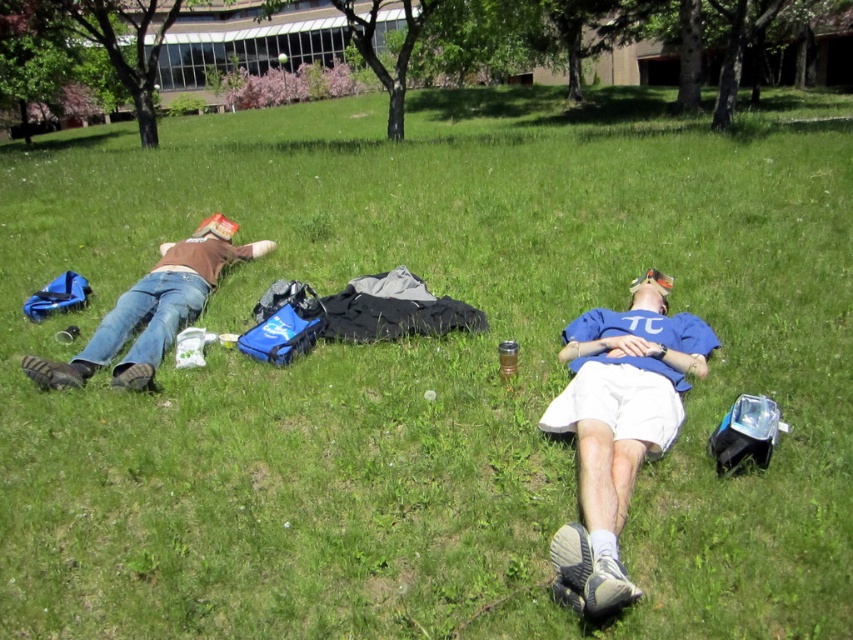
Question: Which point is closer to the camera?

Choices:
 (A) (592, 497)
 (B) (125, 380)

Answer: (A)

Question: Which point is closer to the camera taking this photo?

Choices:
 (A) (653, 440)
 (B) (225, 243)

Answer: (A)

Question: Is the position of blue cotton shirt at center more distant than that of brown matte shirt at left?

Choices:
 (A) no
 (B) yes

Answer: (A)

Question: Can you confirm if blue cotton shirt at center is positioned below brown matte shirt at left?

Choices:
 (A) no
 (B) yes

Answer: (B)

Question: Can you confirm if blue cotton shirt at center is positioned above brown matte shirt at left?

Choices:
 (A) yes
 (B) no

Answer: (B)